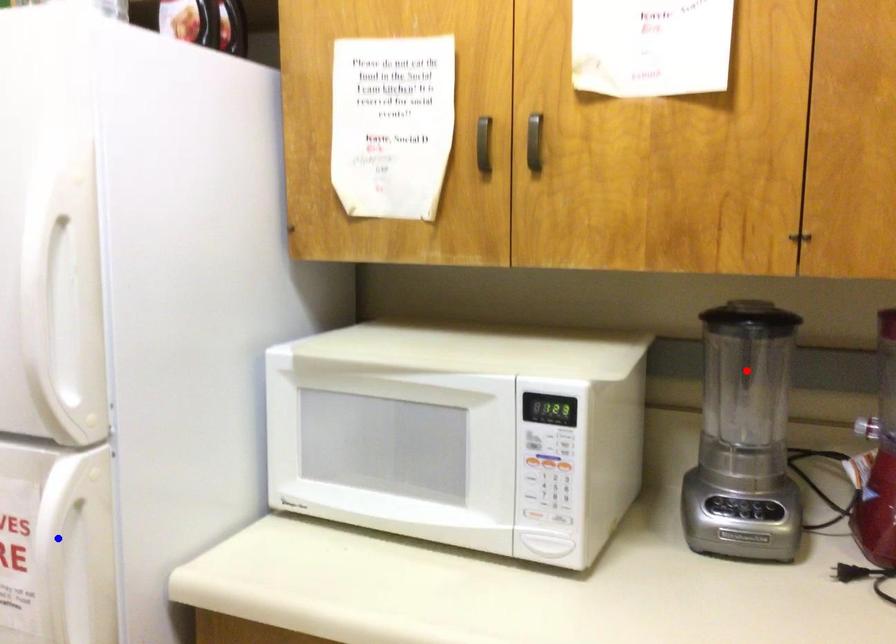
Question: Which of the two points in the image is closer to the camera?

Choices:
 (A) Blue point is closer.
 (B) Red point is closer.

Answer: (A)